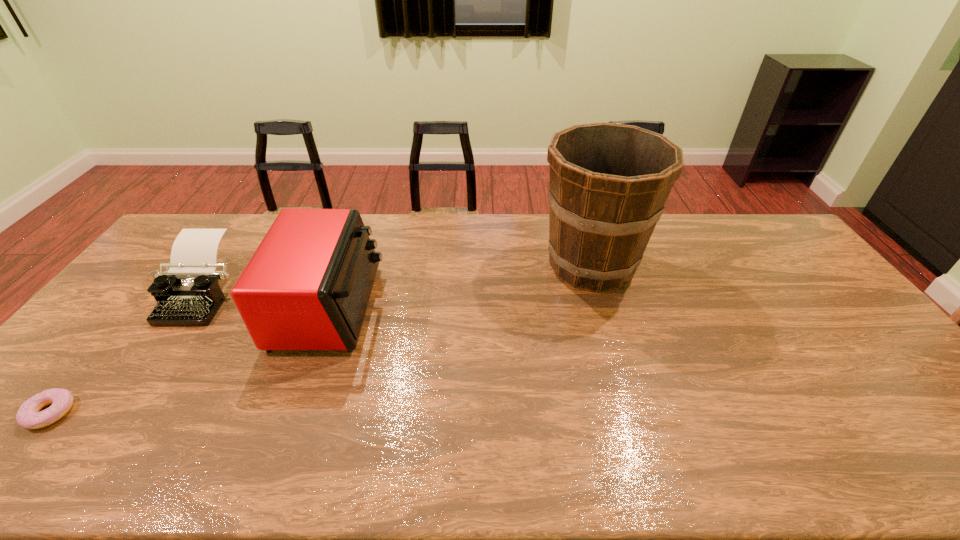
Locate an element on the screen. The height and width of the screenshot is (540, 960). vacant area that lies between the nearest object and the second tallest object is located at coordinates (189, 360).

Where is `vacant space that's between the third tallest object and the tallest object`? The height and width of the screenshot is (540, 960). vacant space that's between the third tallest object and the tallest object is located at coordinates (396, 279).

Where is `vacant area that lies between the typewriter and the tallest object`? This screenshot has height=540, width=960. vacant area that lies between the typewriter and the tallest object is located at coordinates (396, 279).

Where is `free space between the toaster oven and the rightmost object`? free space between the toaster oven and the rightmost object is located at coordinates (460, 286).

Identify which object is the second closest to the bucket. Please provide its 2D coordinates. Your answer should be formatted as a tuple, i.e. [(x, y)], where the tuple contains the x and y coordinates of a point satisfying the conditions above.

[(188, 293)]

Locate which object is the third closest to the doughnut. Please provide its 2D coordinates. Your answer should be formatted as a tuple, i.e. [(x, y)], where the tuple contains the x and y coordinates of a point satisfying the conditions above.

[(608, 183)]

Locate an element on the screen. The image size is (960, 540). free location that satisfies the following two spatial constraints: 1. on the front-facing side of the third shortest object; 2. on the front side of the shortest object is located at coordinates (291, 413).

Where is `free space in the image that satisfies the following two spatial constraints: 1. on the back side of the rightmost object; 2. on the right side of the nearest object`? The image size is (960, 540). free space in the image that satisfies the following two spatial constraints: 1. on the back side of the rightmost object; 2. on the right side of the nearest object is located at coordinates (172, 265).